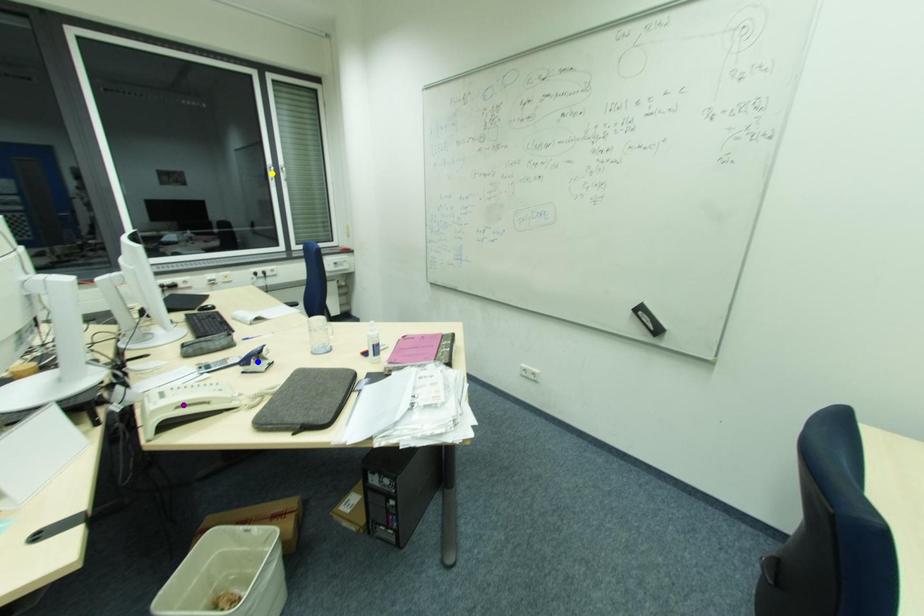
Order these from nearest to farthest:
blue point
yellow point
purple point

1. yellow point
2. blue point
3. purple point